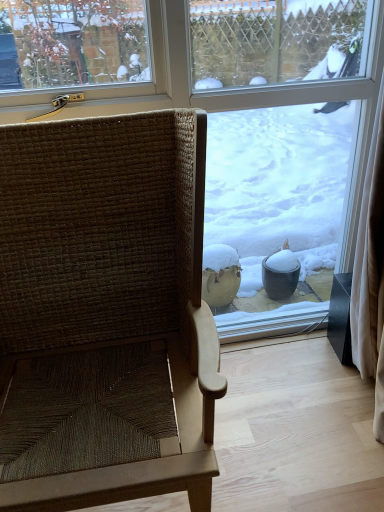
Question: In the image, is transparent glass window at center positioned in front of or behind woven brown chair at left?

Choices:
 (A) front
 (B) behind

Answer: (B)

Question: Is transparent glass window at center wider or thinner than woven brown chair at left?

Choices:
 (A) wide
 (B) thin

Answer: (B)

Question: In the image, is transparent glass window at center on the left side or the right side of woven brown chair at left?

Choices:
 (A) right
 (B) left

Answer: (A)

Question: Would you say woven brown chair at left is to the left or to the right of transparent glass window at center in the picture?

Choices:
 (A) right
 (B) left

Answer: (B)

Question: Considering their positions, is woven brown chair at left located in front of or behind transparent glass window at center?

Choices:
 (A) behind
 (B) front

Answer: (B)

Question: From the image's perspective, is woven brown chair at left located above or below transparent glass window at center?

Choices:
 (A) above
 (B) below

Answer: (B)

Question: In terms of height, does woven brown chair at left look taller or shorter compared to transparent glass window at center?

Choices:
 (A) short
 (B) tall

Answer: (A)